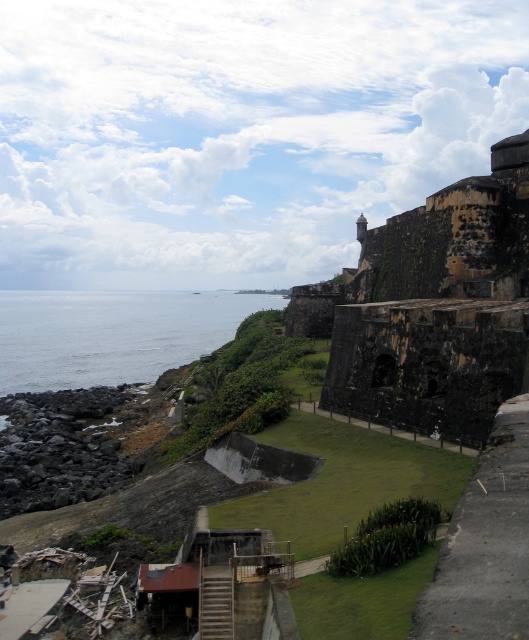
You are a bird soaring above the coastal scene. You want to land on a sturdy surface. Which location would you choose between the dark brown stone wall at upper right and the blue water at lower left?

The dark brown stone wall at upper right is located above the blue water at lower left, so it would be a more suitable surface for landing since water cannot support the bird.

You are standing at the base of the historic fortification and want to reach a specific point marked on your map. The first point you need to locate is point (x=350, y=294), and the second is point (x=172, y=355). Which of these two points is closer to you when viewed from your current position at the base?

Point (x=350, y=294) is in front of point (x=172, y=355), so it is closer to your current position at the base.